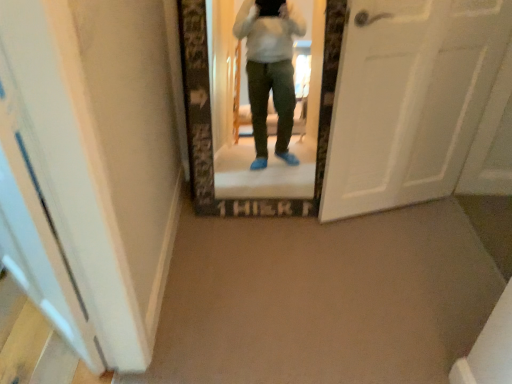
Where is `vacant region below white matte door at right (from a real-world perspective)`? The height and width of the screenshot is (384, 512). vacant region below white matte door at right (from a real-world perspective) is located at coordinates (387, 210).